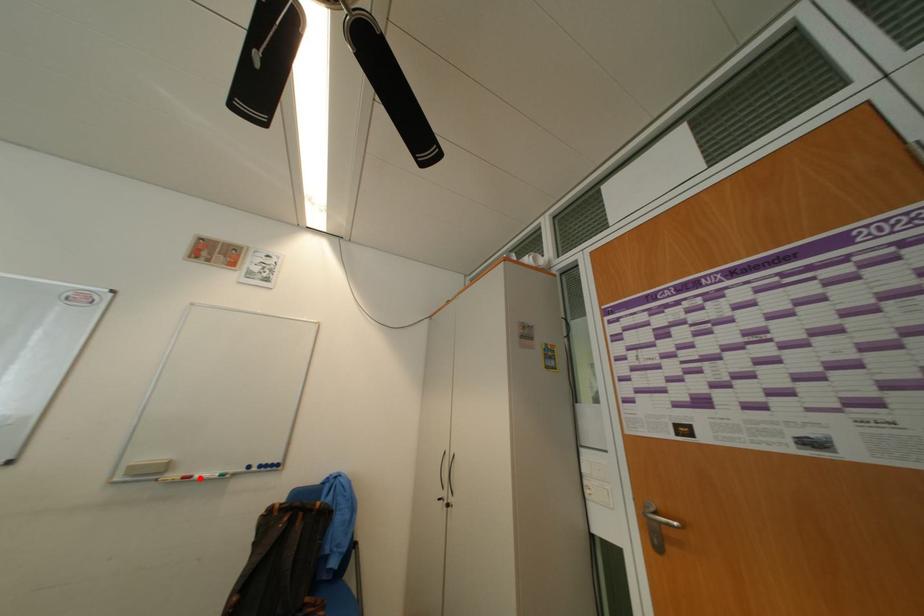
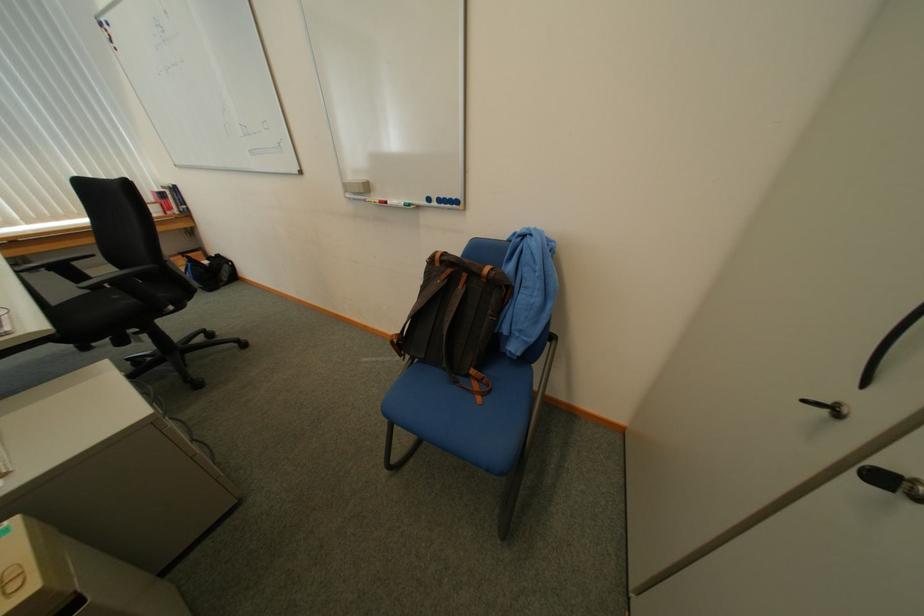
The point at the highlighted location is marked in the first image. Where is the corresponding point in the second image?

(396, 204)